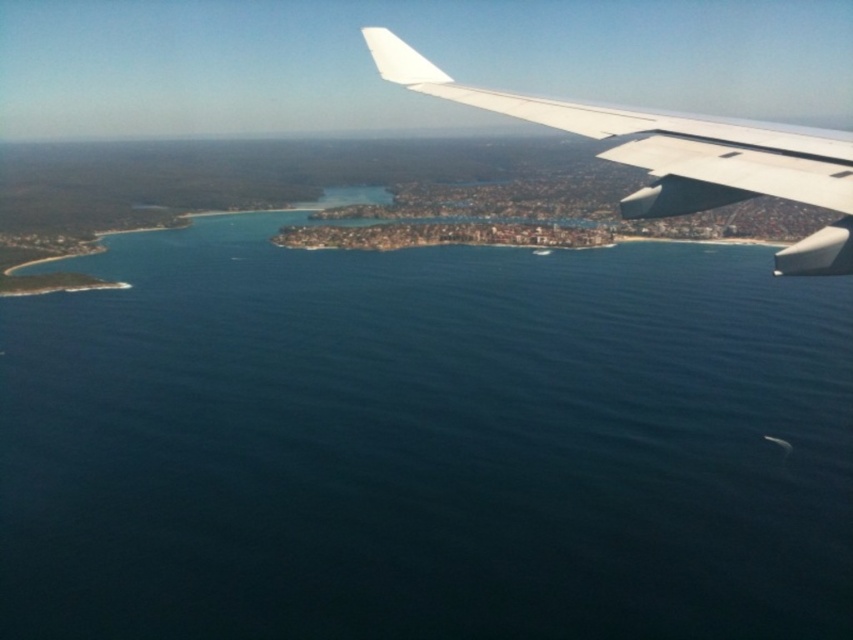
You are a pilot flying an airplane and notice the white matte wing at upper right and the deep blue water at center below. Which object appears larger in height from your current viewpoint?

The deep blue water at center appears much taller than the white matte wing at upper right from the pilot viewpoint.

You are a passenger on the airplane and want to take a photo of the deep blue water at center and the white matte wing at upper right. Which object should you focus on first if you want to capture both in the same frame?

The deep blue water at center is positioned on the left side of the white matte wing at upper right, so you should focus on the white matte wing at upper right first to ensure both objects are in the frame.